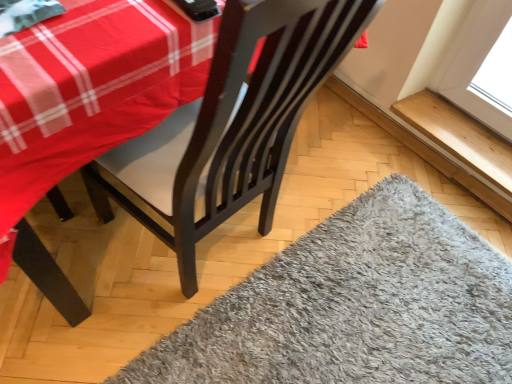
Question: Looking at the image, does wooden at upper right seem bigger or smaller compared to gray shaggy rug at lower right?

Choices:
 (A) big
 (B) small

Answer: (B)

Question: Is point (461, 119) positioned closer to the camera than point (477, 248)?

Choices:
 (A) farther
 (B) closer

Answer: (A)

Question: Is wooden at upper right taller or shorter than gray shaggy rug at lower right?

Choices:
 (A) tall
 (B) short

Answer: (B)

Question: In the image, is gray shaggy rug at lower right positioned in front of or behind wooden at upper right?

Choices:
 (A) front
 (B) behind

Answer: (A)

Question: Is point (307, 246) positioned closer to the camera than point (397, 102)?

Choices:
 (A) closer
 (B) farther

Answer: (A)

Question: Considering the positions of gray shaggy rug at lower right and wooden at upper right in the image, is gray shaggy rug at lower right taller or shorter than wooden at upper right?

Choices:
 (A) tall
 (B) short

Answer: (A)

Question: From a real-world perspective, is gray shaggy rug at lower right positioned above or below wooden at upper right?

Choices:
 (A) below
 (B) above

Answer: (A)